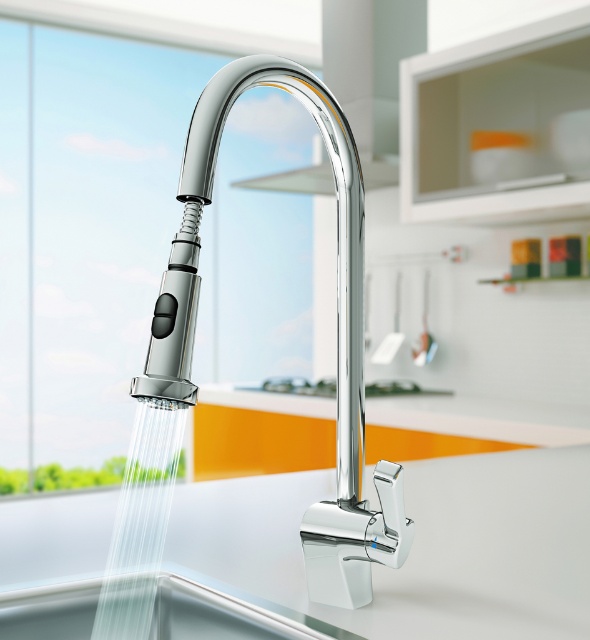
You are standing in the kitchen looking at the faucet and sink. There are two points marked in the image. Which point is closer to you, point (417, 534) or point (345, 189)?

Point (345, 189) is closer to you since point (417, 534) is behind it.